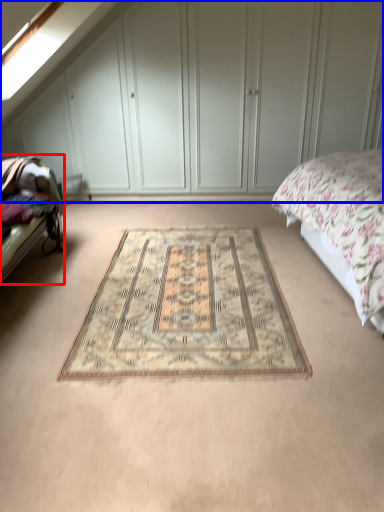
Question: Which object is closer to the camera taking this photo, bed frame (highlighted by a red box) or dresser (highlighted by a blue box)?

Choices:
 (A) bed frame
 (B) dresser

Answer: (A)